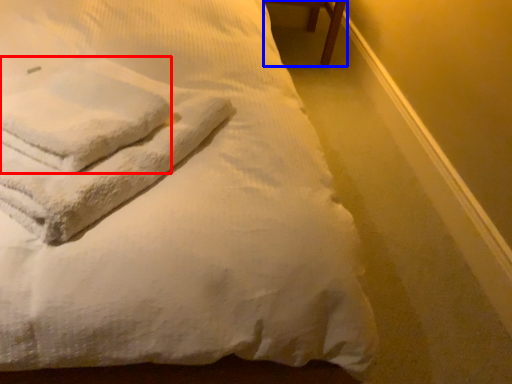
Question: Which of the following is the farthest to the observer, bath towel (highlighted by a red box) or furniture (highlighted by a blue box)?

Choices:
 (A) bath towel
 (B) furniture

Answer: (B)